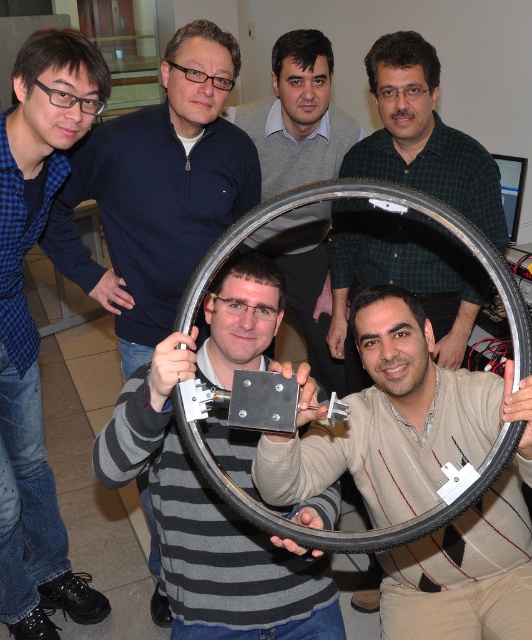
You are a maintenance worker who needs to reach the metallic gray rim at center from the position of the matte black jacket at upper left. Given that your arm can extend 24 inches, can you comfortably reach it without moving your position?

The distance between the matte black jacket at upper left and the metallic gray rim at center is 26.63 inches, which is slightly beyond your arm extension of 24 inches. You would need to adjust your position to reach it comfortably.

Based on the scene described, where is the blue checkered shirt at left located in terms of its 2D coordinates?

The blue checkered shirt at left is located at the 2D coordinates of point (x=36, y=326).